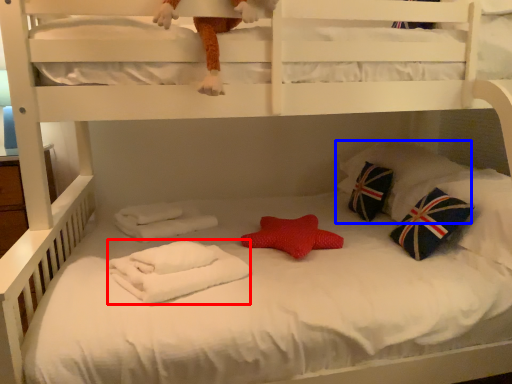
Question: Which point is closer to the camera, material (highlighted by a red box) or pillow (highlighted by a blue box)?

Choices:
 (A) material
 (B) pillow

Answer: (A)